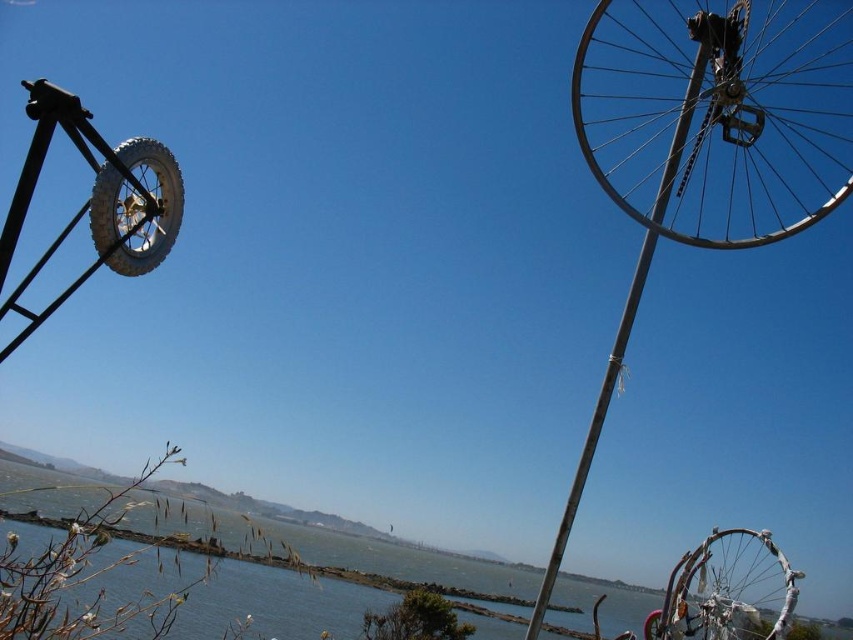
Can you confirm if metallic silver bicycle wheel at upper right is thinner than metallic pole at upper right?

No.

Is point (572, 90) positioned after point (619, 326)?

That is False.

Between point (616, 13) and point (546, 602), which one is positioned behind?

The point (616, 13) is behind.

At what (x,y) coordinates should I click in order to perform the action: click on metallic silver bicycle wheel at upper right. Please return your answer as a coordinate pair (x, y). This screenshot has height=640, width=853. Looking at the image, I should click on (717, 115).

Does metallic pole at upper right have a greater height compared to rubber/textured tire at right?

Indeed, metallic pole at upper right has a greater height compared to rubber/textured tire at right.

Is the position of metallic pole at upper right more distant than that of rubber/textured tire at right?

No, metallic pole at upper right is in front of rubber/textured tire at right.

This screenshot has height=640, width=853. What are the coordinates of `metallic pole at upper right` in the screenshot? It's located at (622, 332).

Is clear blue water at lower center closer to camera compared to metallic pole at upper right?

Yes, clear blue water at lower center is in front of metallic pole at upper right.

Where is `clear blue water at lower center`? This screenshot has width=853, height=640. clear blue water at lower center is located at coordinates (329, 547).